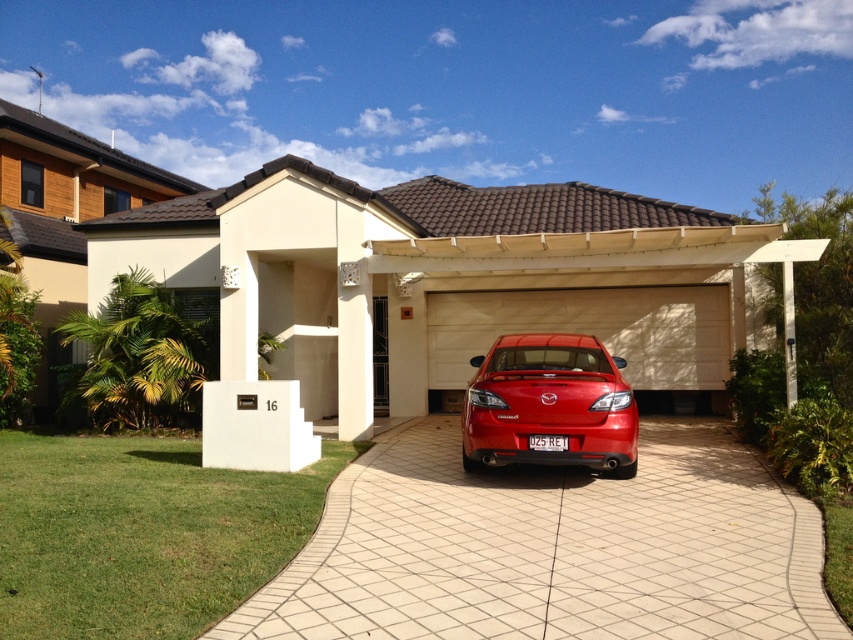
You are a delivery person with a 2.5 meter wide delivery truck. You need to park your truck on the white tile driveway at center. The truck requires a parking space that is at least 6 meters long. Can you park your truck there?

The white tile driveway at center is 5.79 meters apart, which is shorter than the required 6 meters. Therefore, the truck cannot park there.